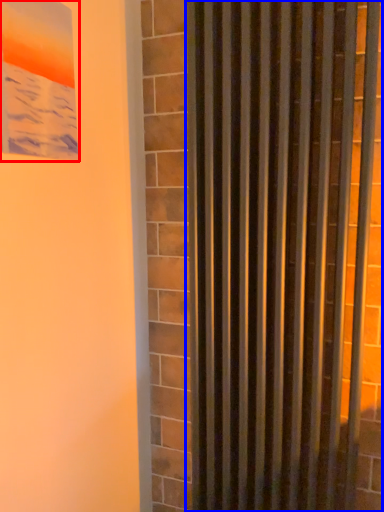
Question: Which object is further to the camera taking this photo, picture frame (highlighted by a red box) or curtain (highlighted by a blue box)?

Choices:
 (A) picture frame
 (B) curtain

Answer: (B)